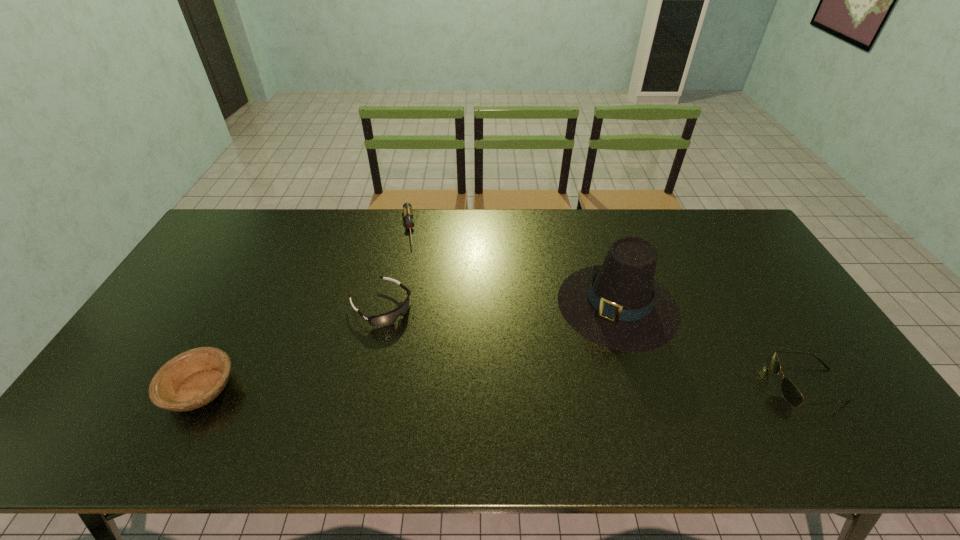
The height and width of the screenshot is (540, 960). What are the coordinates of `object at the far edge` in the screenshot? It's located at click(x=407, y=207).

You are a GUI agent. You are given a task and a screenshot of the screen. Output one action in this format:
    pyautogui.click(x=<x>, y=<y>)
    Task: Click on the bowl present at the near edge
    The height and width of the screenshot is (540, 960).
    Given the screenshot: What is the action you would take?
    pyautogui.click(x=192, y=379)

This screenshot has width=960, height=540. Find the location of `sunglasses located in the near edge section of the desktop`. sunglasses located in the near edge section of the desktop is located at coordinates (791, 394).

Where is `object that is at the left edge`? object that is at the left edge is located at coordinates (192, 379).

In order to click on object that is at the right edge in this screenshot , I will do `click(791, 394)`.

At what (x,y) coordinates should I click in order to perform the action: click on object that is at the near left corner. Please return your answer as a coordinate pair (x, y). Looking at the image, I should click on (192, 379).

You are a GUI agent. You are given a task and a screenshot of the screen. Output one action in this format:
    pyautogui.click(x=<x>, y=<y>)
    Task: Click on the object situated at the near right corner
    
    Given the screenshot: What is the action you would take?
    pyautogui.click(x=791, y=394)

Where is `vacant point at the far edge`? Image resolution: width=960 pixels, height=540 pixels. vacant point at the far edge is located at coordinates point(530,226).

In the image, there is a desktop. Where is `vacant region at the near edge`? This screenshot has height=540, width=960. vacant region at the near edge is located at coordinates (463, 387).

Locate an element on the screen. The height and width of the screenshot is (540, 960). blank space at the left edge of the desktop is located at coordinates (232, 278).